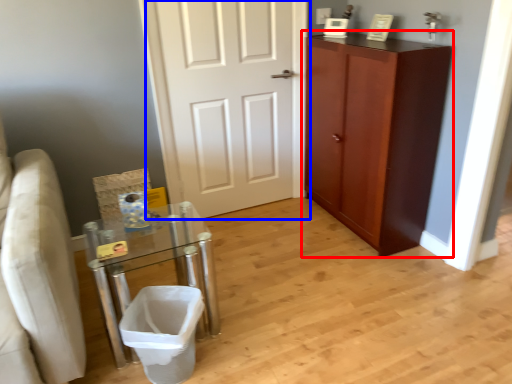
Question: Which of the following is the closest to the observer, cabinetry (highlighted by a red box) or door (highlighted by a blue box)?

Choices:
 (A) cabinetry
 (B) door

Answer: (A)